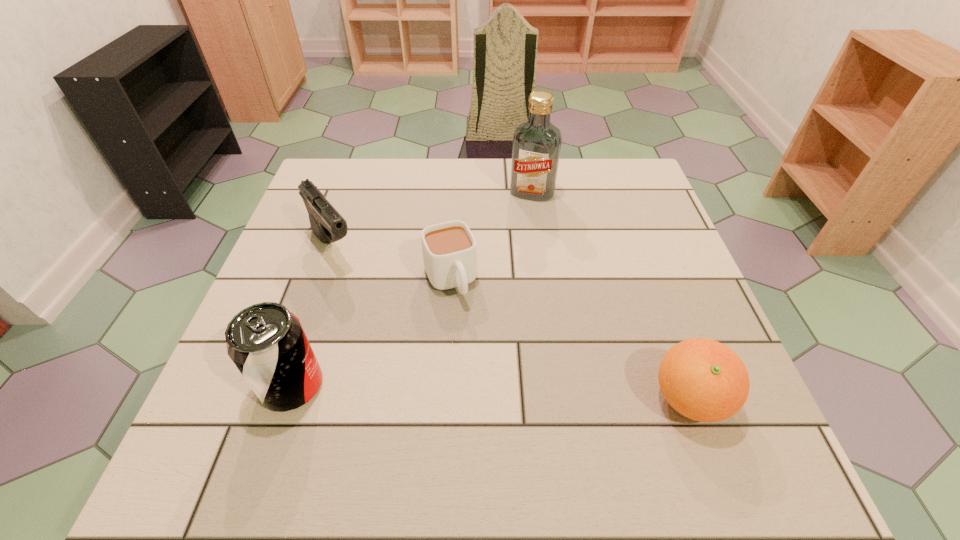
Where is `soda can`? soda can is located at coordinates (266, 342).

This screenshot has height=540, width=960. What are the coordinates of `orange` in the screenshot? It's located at (704, 380).

Find the location of a particular element. This screenshot has width=960, height=540. the second shortest object is located at coordinates (704, 380).

Locate an element on the screen. The height and width of the screenshot is (540, 960). pistol is located at coordinates (327, 224).

Locate an element on the screen. the shortest object is located at coordinates (449, 249).

Where is `cup`? This screenshot has width=960, height=540. cup is located at coordinates (449, 249).

Find the location of a particular element. Image resolution: width=960 pixels, height=540 pixels. vodka is located at coordinates (536, 147).

At what (x,y) coordinates should I click in order to perform the action: click on the farthest object. Please return your answer as a coordinate pair (x, y). This screenshot has width=960, height=540. Looking at the image, I should click on (536, 147).

Where is `free space located on the right of the soda can`? The width and height of the screenshot is (960, 540). free space located on the right of the soda can is located at coordinates (433, 386).

The width and height of the screenshot is (960, 540). Find the location of `free space located 0.220m on the back of the fourth tallest object`. free space located 0.220m on the back of the fourth tallest object is located at coordinates (647, 282).